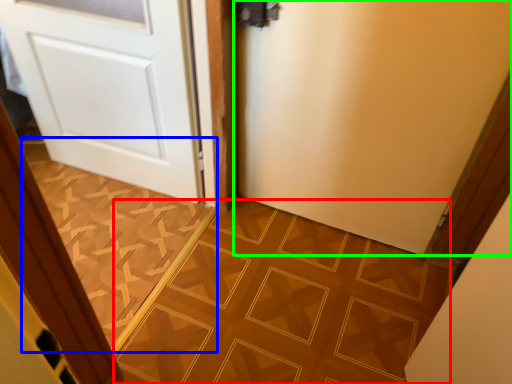
Question: Which is nearer to the ceramic tile (highlighted by a red box)? ceramic tile (highlighted by a blue box) or door (highlighted by a green box).

Choices:
 (A) ceramic tile
 (B) door

Answer: (A)